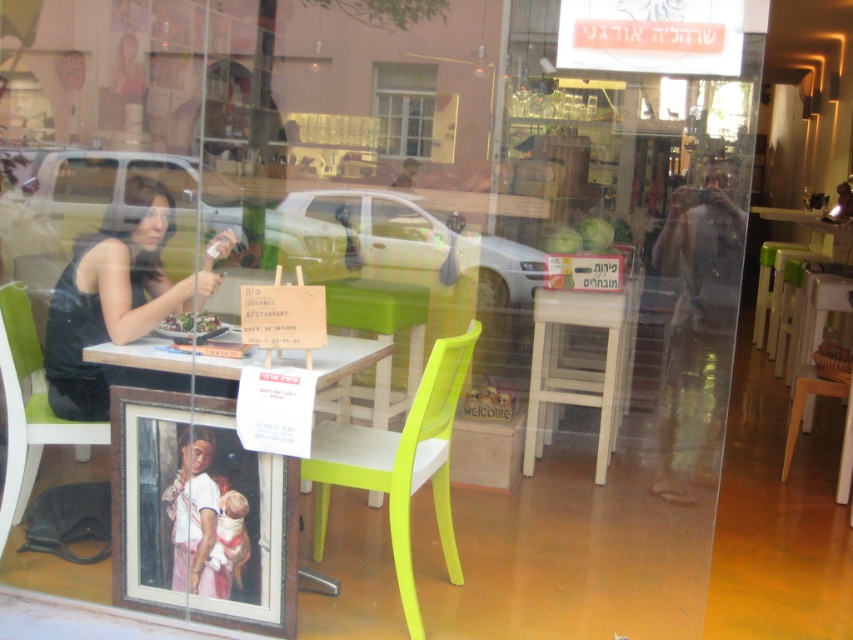
Question: Which is nearer to the metallic silver phone at right?

Choices:
 (A) white glossy table at center
 (B) white wood table at center

Answer: (B)

Question: From the image, what is the correct spatial relationship of transparent glass door at center in relation to lime green plastic chair at center?

Choices:
 (A) below
 (B) above

Answer: (B)

Question: Which of these objects is positioned closest to the white wood table at center?

Choices:
 (A) clear glass window at center
 (B) black matte dress at left
 (C) lime green plastic chair at center
 (D) green plastic chair at lower left

Answer: (C)

Question: Which point is farther to the camera?

Choices:
 (A) (378, 488)
 (B) (526, 20)
 (C) (32, 442)
 (D) (682, 480)

Answer: (B)

Question: Is black matte dress at left positioned behind green plastic chair at lower left?

Choices:
 (A) no
 (B) yes

Answer: (A)

Question: Can you confirm if lime green plastic chair at center is positioned below green plastic chair at lower left?

Choices:
 (A) no
 (B) yes

Answer: (B)